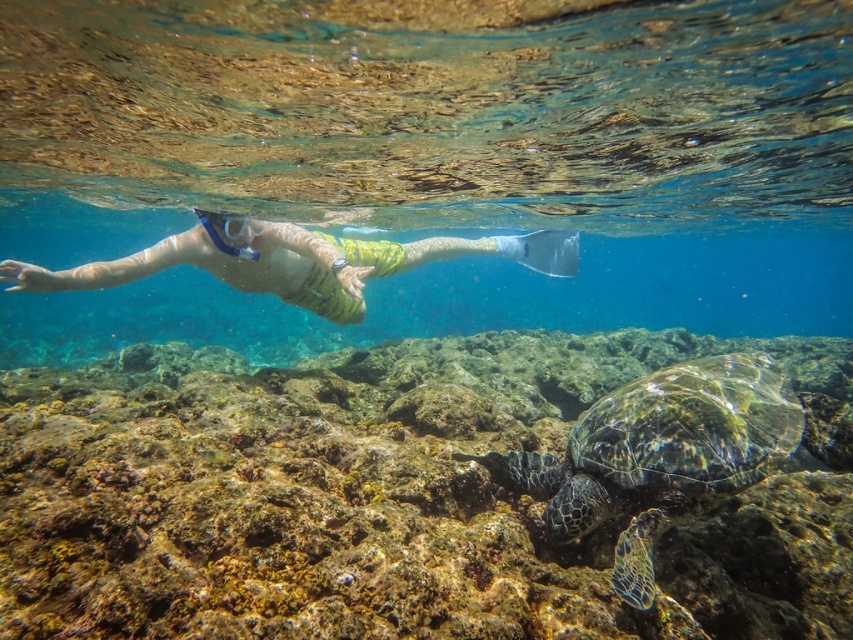
Question: Which object appears farthest from the camera in this image?

Choices:
 (A) yellow-green fabric at center
 (B) transparent rubber snorkel at center
 (C) clear water at turtle center
 (D) green rough coral reef at center

Answer: (B)

Question: Is the position of green rough coral reef at center less distant than that of clear water at turtle center?

Choices:
 (A) yes
 (B) no

Answer: (A)

Question: Which object is closer to the camera taking this photo?

Choices:
 (A) green textured shell at center
 (B) clear water at turtle center
 (C) yellow-green fabric at center
 (D) transparent rubber snorkel at center

Answer: (A)

Question: Estimate the real-world distances between objects in this image. Which object is farther from the clear water at turtle center?

Choices:
 (A) green rough coral reef at center
 (B) transparent rubber snorkel at center
 (C) green textured shell at center
 (D) yellow-green fabric at center

Answer: (B)

Question: Does green rough coral reef at center have a greater width compared to green textured shell at center?

Choices:
 (A) no
 (B) yes

Answer: (B)

Question: Can you confirm if clear water at turtle center is smaller than green textured shell at center?

Choices:
 (A) yes
 (B) no

Answer: (B)